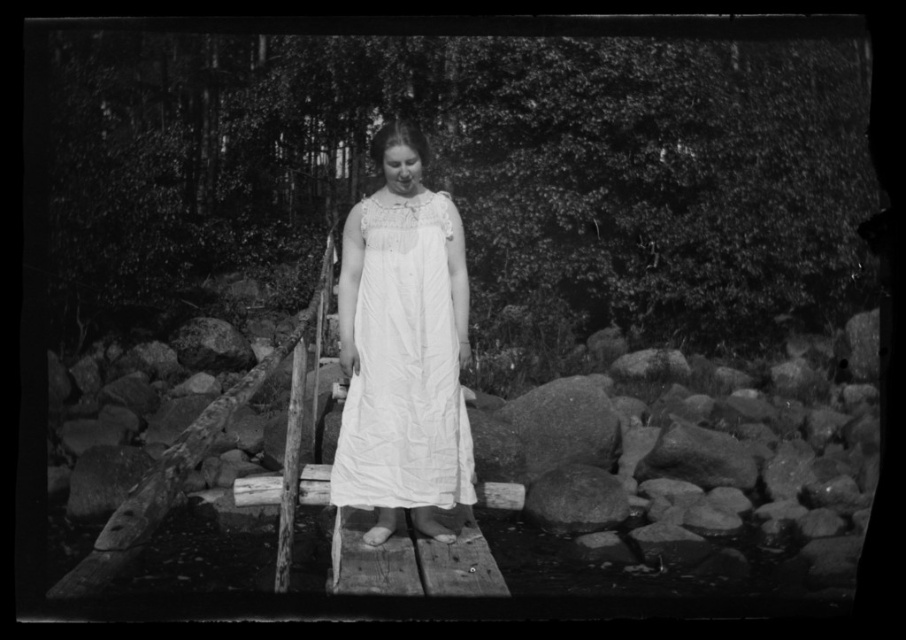
Question: Which point is farther to the camera?

Choices:
 (A) granite rock at center
 (B) white cotton dress at center
 (C) smooth gray rock at lower center

Answer: (A)

Question: Which object is farther from the camera taking this photo?

Choices:
 (A) smooth gray rock at lower center
 (B) granite rock at center
 (C) white cotton dress at center

Answer: (B)

Question: Is granite rock at center bigger than smooth gray rock at lower center?

Choices:
 (A) yes
 (B) no

Answer: (A)

Question: Is white cotton dress at center below granite rock at center?

Choices:
 (A) yes
 (B) no

Answer: (B)

Question: Which of the following is the farthest from the observer?

Choices:
 (A) (451, 445)
 (B) (560, 388)

Answer: (B)

Question: Is white cotton dress at center positioned before smooth gray rock at lower center?

Choices:
 (A) no
 (B) yes

Answer: (B)